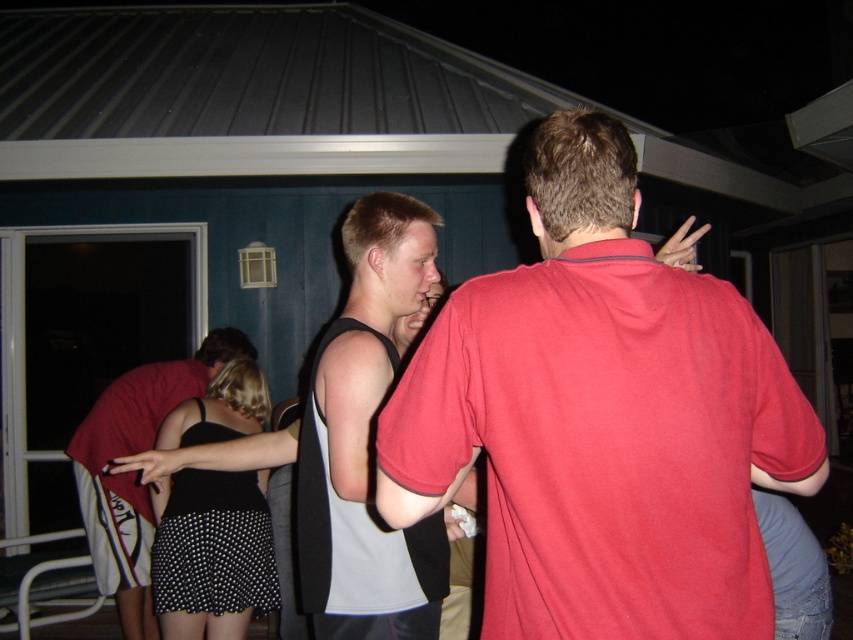
You are a photographer trying to capture a group photo of the matte red shirt at center and the black sleeveless shirt at center. Since you want everyone to be visible, which person should you position closer to the camera?

The matte red shirt at center should be positioned closer to the camera because it has a lesser height compared to the black sleeveless shirt at center, ensuring both are visible in the photo.

You are standing at the point marked as point (341, 636) in the image. The sliding glass door is on the left side of the frame. Can you reach the sliding glass door without moving your feet?

The point marked as point (341, 636) is 1.83 meters away from the viewer. Since the sliding glass door is on the left side of the frame, it is possible that the distance between the point and the door is within reach, but without knowing the exact distance between them, it is uncertain. However, based on the given information, the viewer is 1.83 meters away from the point, so if the door is within arm reach from that point, then yes. Otherwise, no.